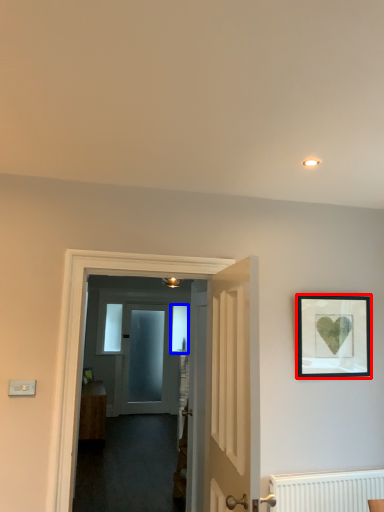
Question: Which point is further to the camera, picture frame (highlighted by a red box) or window (highlighted by a blue box)?

Choices:
 (A) picture frame
 (B) window

Answer: (B)